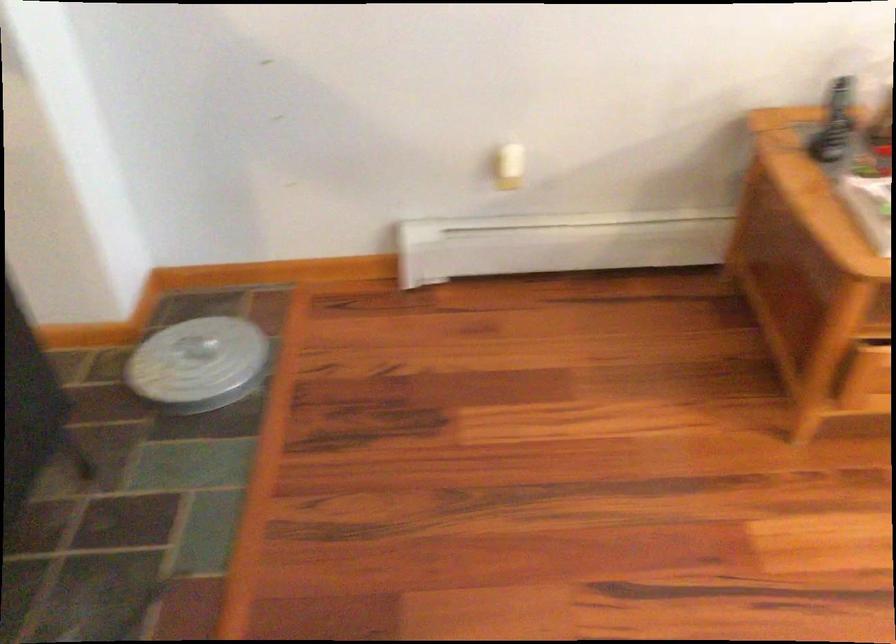
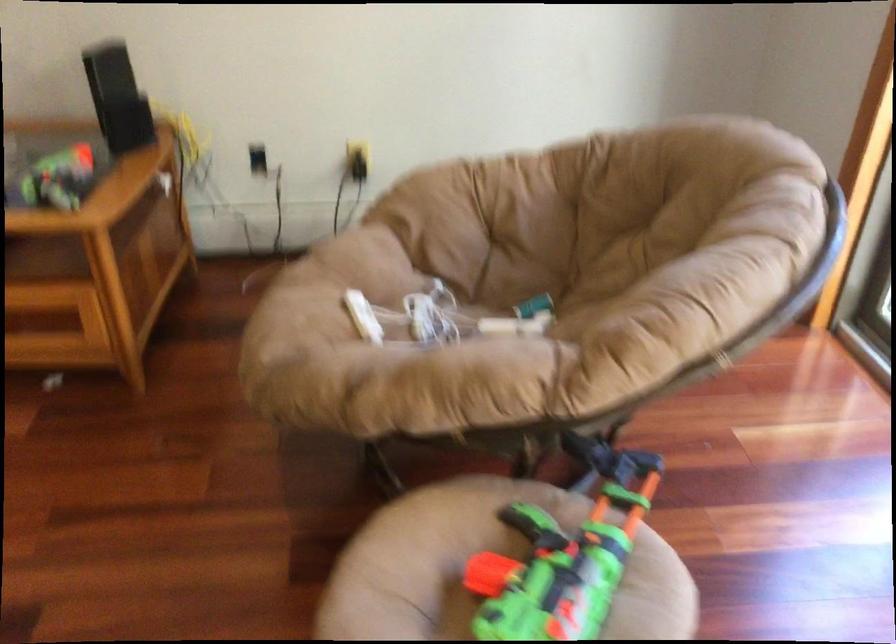
Question: What movement of the cameraman would produce the second image?

Choices:
 (A) Left
 (B) Right
 (C) Forward
 (D) Backward

Answer: (B)